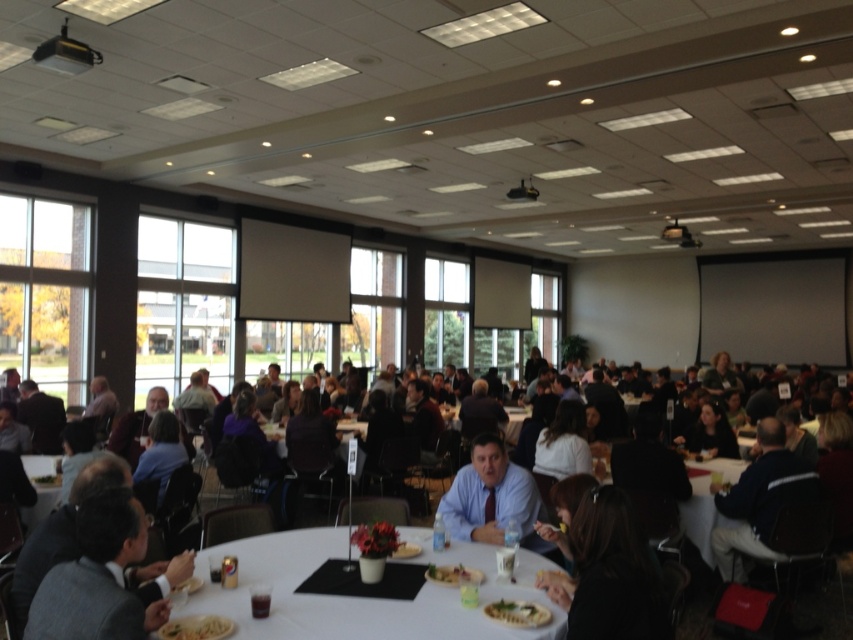
You are a photographer planning to take a group photo of the attendees at the event. You want to ensure that both the light blue shirt at center and the white plastic table at center are clearly visible in the photo. Based on their sizes, which object should you focus on to ensure both are in frame?

The light blue shirt at center occupies less space than the white plastic table at center, so focusing on the white plastic table at center will ensure both are in frame since it is larger and can accommodate the smaller object within the same shot.

You are at a formal business event and need to locate two specific points in the room. The first point is at coordinates point (x=281, y=634) and the second is at point (x=36, y=513). From your current position, which point is nearer to you?

Point (x=281, y=634) is closer to the camera than point (x=36, y=513), so the first point is nearer to you.

You are a waiter in the event space and need to deliver a drink to the table where the yellowish matte plate at center is located. What are the coordinates of the plate to help you locate the table?

The coordinates of the yellowish matte plate at center are at point (x=451, y=573), so the table can be found at those coordinates.